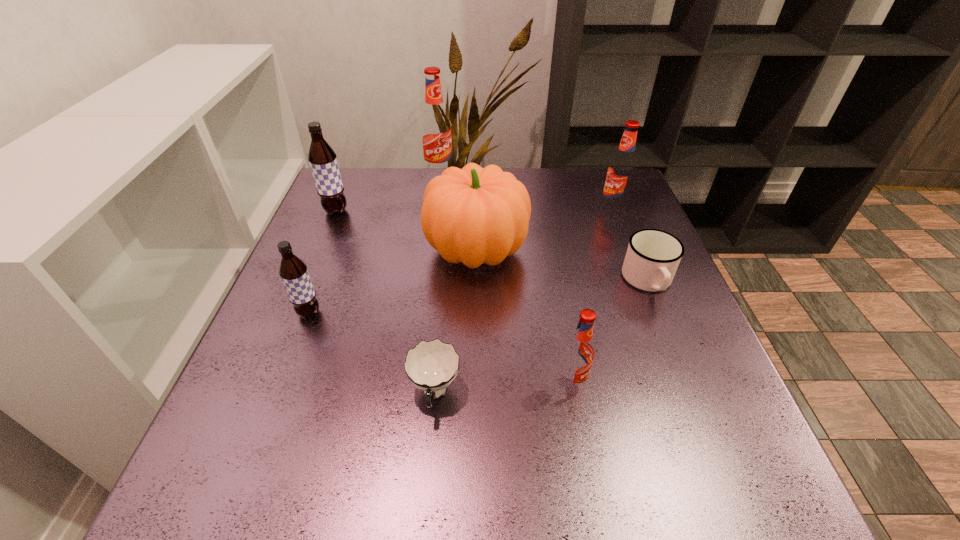
You are a GUI agent. You are given a task and a screenshot of the screen. Output one action in this format:
    pyautogui.click(x=<x>, y=<y>)
    Task: Click on the free spot located 0.080m on the side of the cup with the handle
    This screenshot has height=540, width=960.
    Given the screenshot: What is the action you would take?
    pyautogui.click(x=427, y=473)

Where is `root beer at the right edge`? root beer at the right edge is located at coordinates (621, 171).

At what (x,y) coordinates should I click in order to perform the action: click on mug at the right edge. Please return your answer as a coordinate pair (x, y). This screenshot has width=960, height=540. Looking at the image, I should click on (652, 258).

In order to click on object that is at the far left corner in this screenshot , I will do `click(323, 162)`.

This screenshot has height=540, width=960. I want to click on object located in the far right corner section of the desktop, so click(621, 171).

At what (x,y) coordinates should I click in order to perform the action: click on vacant space at the far edge of the desktop. Please return your answer as a coordinate pair (x, y). This screenshot has width=960, height=540. Looking at the image, I should click on (529, 184).

The image size is (960, 540). In order to click on vacant space at the left edge of the desktop in this screenshot , I will do `click(344, 315)`.

This screenshot has width=960, height=540. In the image, there is a desktop. What are the coordinates of `vacant space at the right edge` in the screenshot? It's located at (704, 334).

At what (x,y) coordinates should I click in order to perform the action: click on free location at the far right corner of the desktop. Please return your answer as a coordinate pair (x, y). Looking at the image, I should click on (587, 194).

You are a GUI agent. You are given a task and a screenshot of the screen. Output one action in this format:
    pyautogui.click(x=<x>, y=<y>)
    Task: Click on the empty location between the third root beer from right to left and the bigger brown root beer
    The image size is (960, 540).
    Given the screenshot: What is the action you would take?
    pyautogui.click(x=388, y=193)